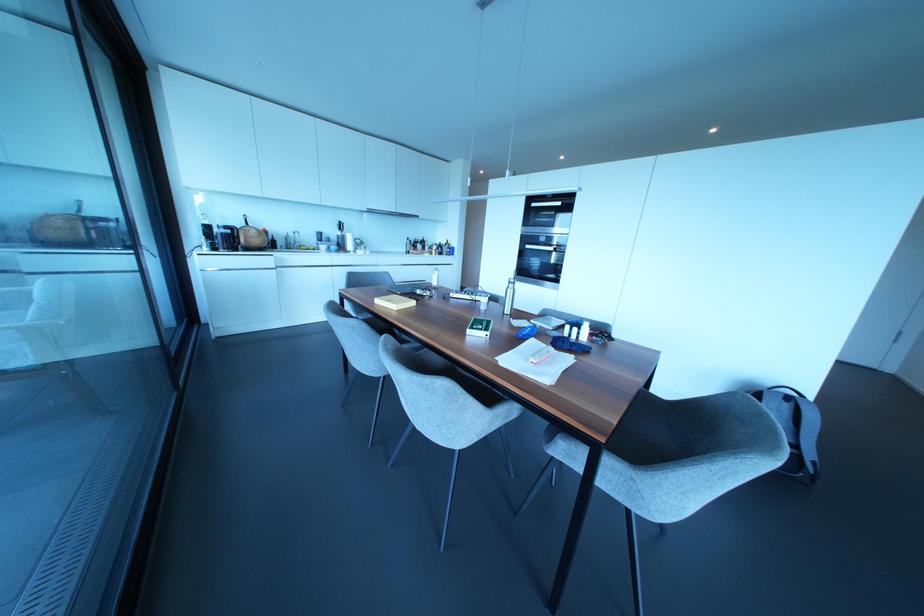
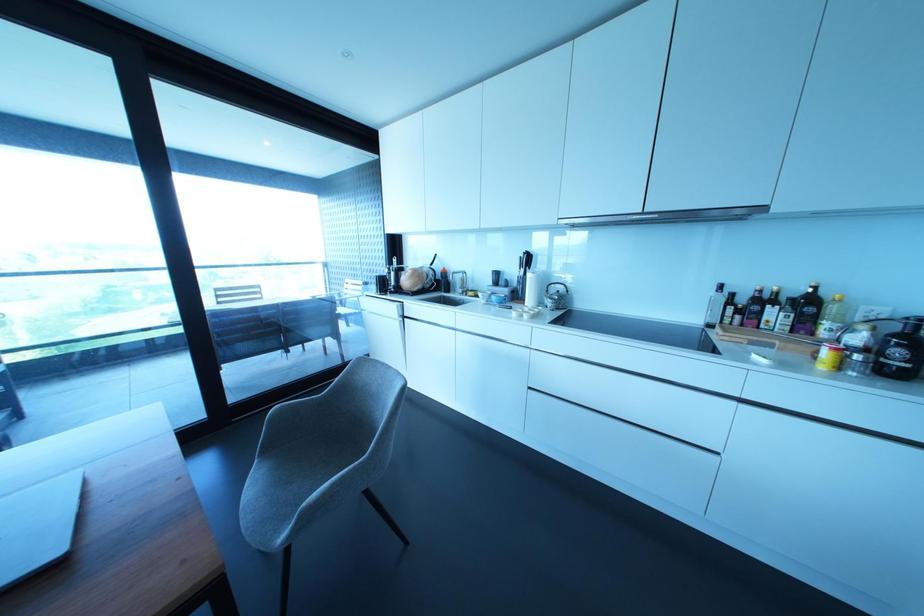
In the second image, find the point that corresponds to pixel 421 241 in the first image.

(807, 304)